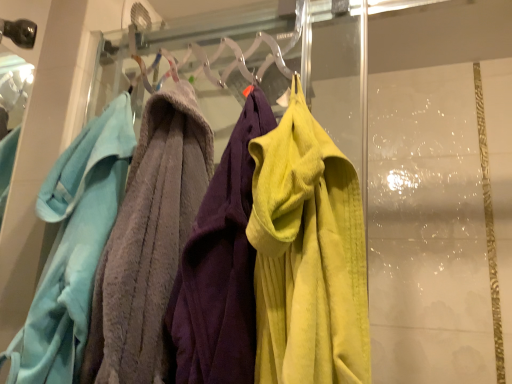
Question: Considering the positions of point (323, 317) and point (106, 145), is point (323, 317) closer or farther from the camera than point (106, 145)?

Choices:
 (A) closer
 (B) farther

Answer: (A)

Question: From the image's perspective, is soft yellow towel at center, the second towel positioned from the left, above or below soft gray towel at left, which ranks as the 2th towel in right-to-left order?

Choices:
 (A) below
 (B) above

Answer: (B)

Question: In the image, is soft yellow towel at center, the second towel positioned from the left, positioned in front of or behind soft gray towel at left, which ranks as the 2th towel in right-to-left order?

Choices:
 (A) front
 (B) behind

Answer: (A)

Question: Does point (14, 349) appear closer or farther from the camera than point (328, 276)?

Choices:
 (A) farther
 (B) closer

Answer: (A)

Question: Is soft gray towel at left, the first towel in the left-to-right sequence, taller or shorter than soft yellow towel at center, the second towel positioned from the left?

Choices:
 (A) short
 (B) tall

Answer: (B)

Question: Is soft gray towel at left, the first towel in the left-to-right sequence, inside the boundaries of soft yellow towel at center, which is counted as the first towel, starting from the right, or outside?

Choices:
 (A) outside
 (B) inside

Answer: (A)

Question: Relative to soft yellow towel at center, which is counted as the first towel, starting from the right, is soft gray towel at left, the first towel in the left-to-right sequence, in front or behind?

Choices:
 (A) behind
 (B) front

Answer: (A)